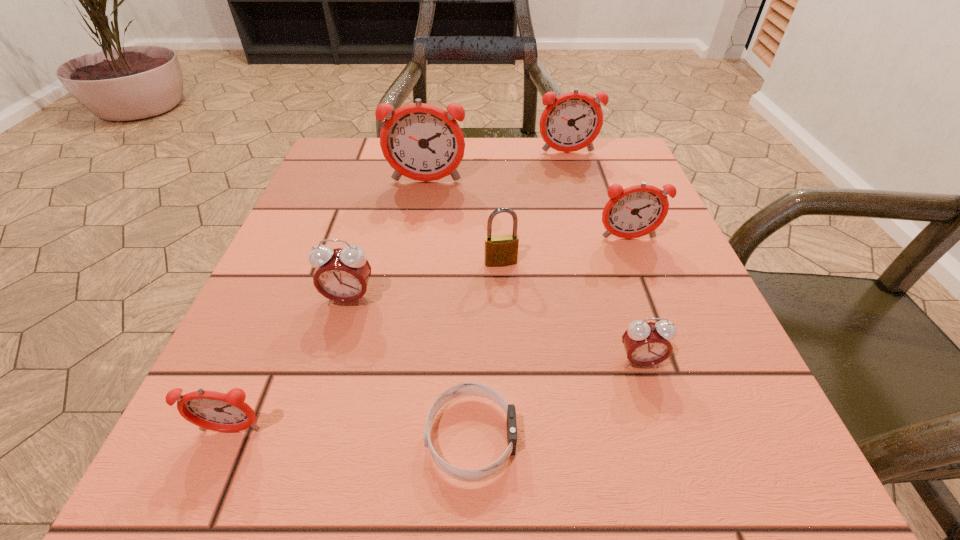
The height and width of the screenshot is (540, 960). Find the location of `free location at the left edge of the desktop`. free location at the left edge of the desktop is located at coordinates (307, 313).

The image size is (960, 540). In order to click on blank area at the right edge in this screenshot , I will do `click(593, 241)`.

The height and width of the screenshot is (540, 960). I want to click on free space at the far left corner of the desktop, so click(x=380, y=159).

In the image, there is a desktop. Identify the location of vacant space at the near left corner. This screenshot has height=540, width=960. (254, 437).

Identify the location of free space at the far right corner. The height and width of the screenshot is (540, 960). (575, 165).

The image size is (960, 540). In the image, there is a desktop. In order to click on vacant space at the near right corner in this screenshot , I will do `click(798, 476)`.

I want to click on empty space that is in between the fifth nearest object and the seventh nearest object, so click(x=464, y=222).

The height and width of the screenshot is (540, 960). I want to click on free area in between the padlock and the third nearest object, so click(x=570, y=312).

Where is `vacant area that lies between the wristband and the biggest reddish-pink alarm clock`? vacant area that lies between the wristband and the biggest reddish-pink alarm clock is located at coordinates (448, 309).

Find the location of a particular element. This screenshot has width=960, height=540. free space between the nearest alarm clock and the second nearest alarm clock is located at coordinates (436, 396).